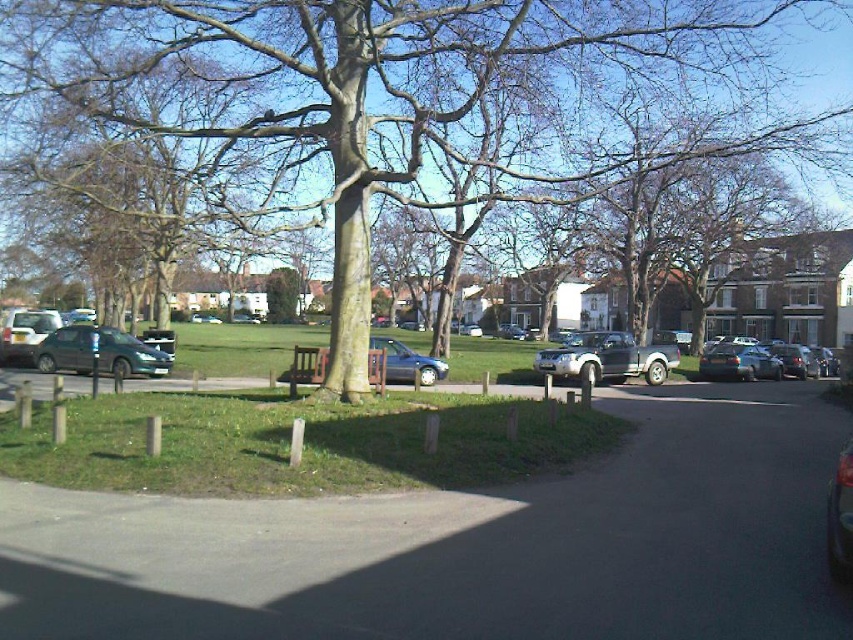
Question: Can you confirm if silver metallic pickup truck at center is positioned below metallic silver car at center?

Choices:
 (A) no
 (B) yes

Answer: (B)

Question: Considering the real-world distances, which object is farthest from the shiny silver sedan at center right?

Choices:
 (A) brown textured tree at center
 (B) metallic silver car at left

Answer: (B)

Question: Which is nearer to the satin silver suv at center?

Choices:
 (A) metallic silver car at center
 (B) metallic silver car at left
 (C) satin silver car at center
 (D) brown textured tree at center

Answer: (A)

Question: Can you confirm if metallic silver car at left is smaller than metallic silver car at center?

Choices:
 (A) yes
 (B) no

Answer: (A)

Question: From the image, what is the correct spatial relationship of brown textured tree at center in relation to silver metallic pickup truck at center?

Choices:
 (A) below
 (B) above

Answer: (B)

Question: Which object is the farthest from the metallic silver car at left?

Choices:
 (A) satin silver suv at center
 (B) shiny silver sedan at center right
 (C) satin silver car at center

Answer: (A)